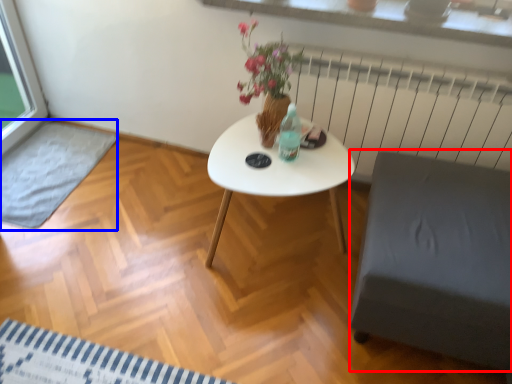
Question: Among these objects, which one is farthest to the camera, armchair (highlighted by a red box) or wide (highlighted by a blue box)?

Choices:
 (A) armchair
 (B) wide

Answer: (B)